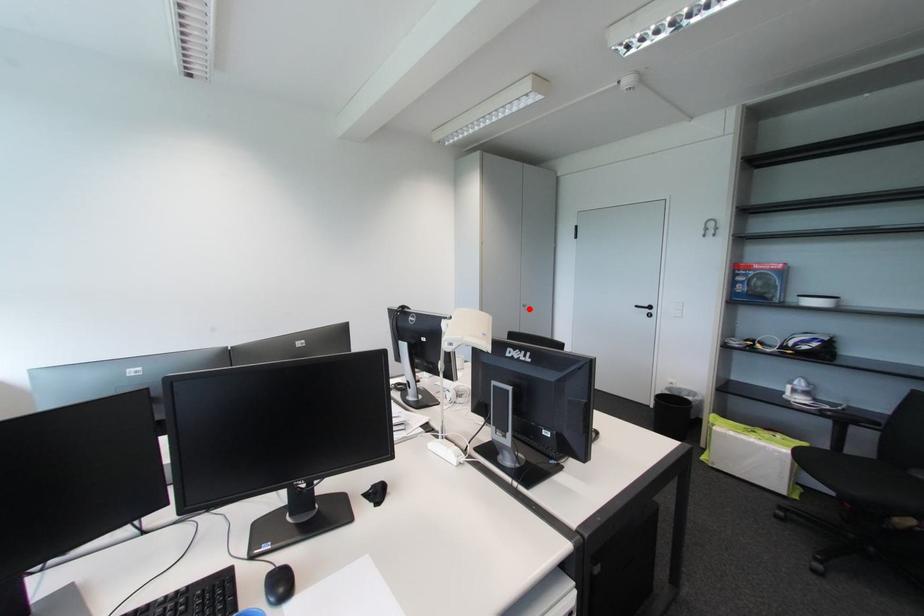
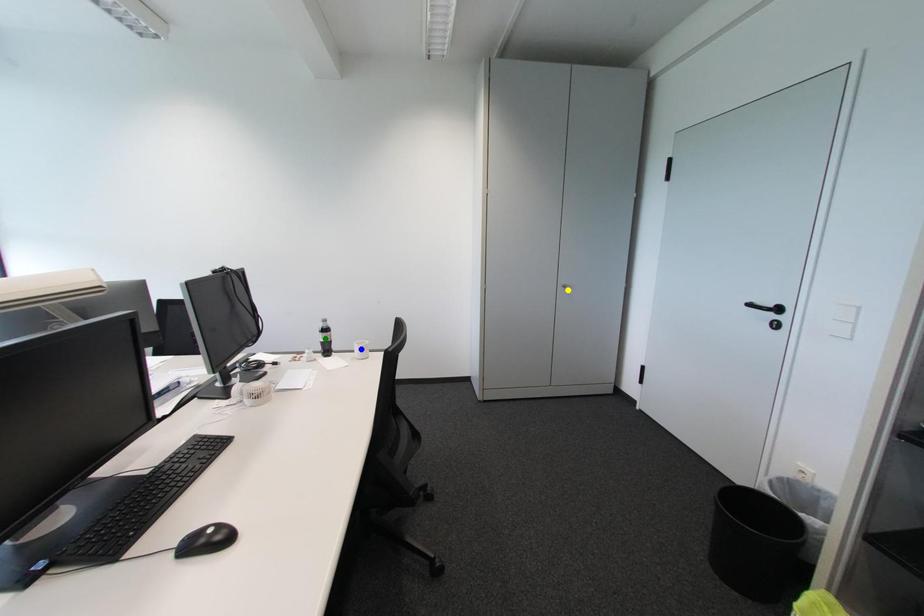
Question: I am providing you with two images of the same scene from different viewpoints. A red point is marked on the first image. You are given multiple points on the second image. Which mark in image 2 goes with the point in image 1?

Choices:
 (A) yellow point
 (B) green point
 (C) blue point

Answer: (A)